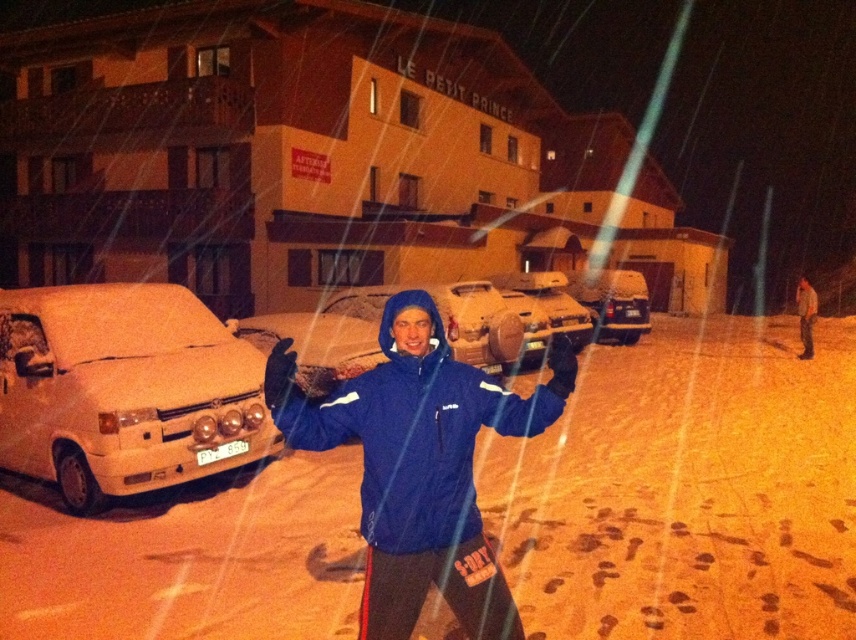
Is blue matte jacket at center shorter than snow-covered sedan at center?

Correct, blue matte jacket at center is not as tall as snow-covered sedan at center.

Where is `blue matte jacket at center`? This screenshot has width=856, height=640. blue matte jacket at center is located at coordinates (419, 465).

Locate an element on the screen. This screenshot has height=640, width=856. blue matte jacket at center is located at coordinates (419, 465).

Identify the location of blue matte jacket at center. click(x=419, y=465).

Does white matte car at left have a greater height compared to blue matte jacket at center?

Yes, white matte car at left is taller than blue matte jacket at center.

Locate an element on the screen. Image resolution: width=856 pixels, height=640 pixels. white matte car at left is located at coordinates (123, 390).

You are a GUI agent. You are given a task and a screenshot of the screen. Output one action in this format:
    pyautogui.click(x=<x>, y=<y>)
    Task: Click on the white matte car at left
    Image resolution: width=856 pixels, height=640 pixels.
    Given the screenshot: What is the action you would take?
    [x=123, y=390]

Between white matte car at left and snow-covered sedan at center, which one is positioned lower?

white matte car at left is below.

Which of these two, white matte car at left or snow-covered sedan at center, stands taller?

white matte car at left is taller.

Does point (60, 442) come behind point (605, 321)?

No, (60, 442) is in front of (605, 321).

This screenshot has width=856, height=640. I want to click on white matte car at left, so click(123, 390).